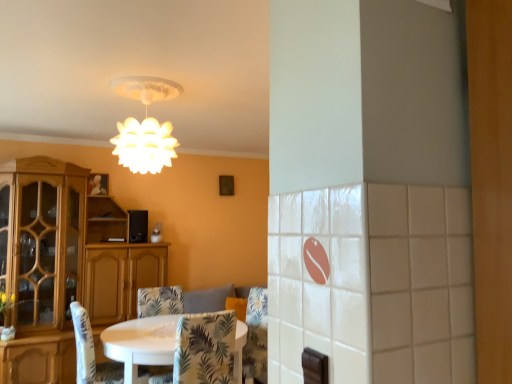
Question: From the image's perspective, is wooden cabinet at left positioned above or below patterned fabric chair at center, the third chair when ordered from back to front?

Choices:
 (A) below
 (B) above

Answer: (B)

Question: From a real-world perspective, relative to patterned fabric chair at center, which appears as the first chair when viewed from the front, is wooden cabinet at left vertically above or below?

Choices:
 (A) below
 (B) above

Answer: (B)

Question: Considering the real-world distances, which object is farthest from the floral fabric chair at center, the 3th chair when ordered from front to back?

Choices:
 (A) patterned fabric chair at center, the third chair when ordered from back to front
 (B) white matte lampshade at upper center
 (C) wooden cabinet at left
 (D) white fabric chair at lower left, the second chair viewed from the front

Answer: (B)

Question: Which object is positioned farthest from the patterned fabric chair at center, which appears as the first chair when viewed from the front?

Choices:
 (A) floral fabric chair at center, the 3th chair when ordered from front to back
 (B) wooden cabinet at left
 (C) white fabric chair at lower left, the second chair viewed from the front
 (D) white matte lampshade at upper center

Answer: (B)